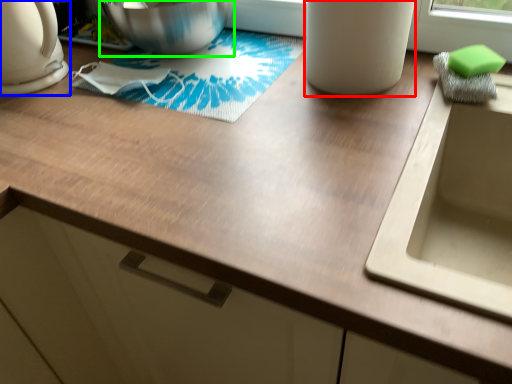
Question: Which object is the farthest from appliance (highlighted by a red box)? Choose among these: kitchen appliance (highlighted by a blue box) or mixing bowl (highlighted by a green box).

Choices:
 (A) kitchen appliance
 (B) mixing bowl

Answer: (A)